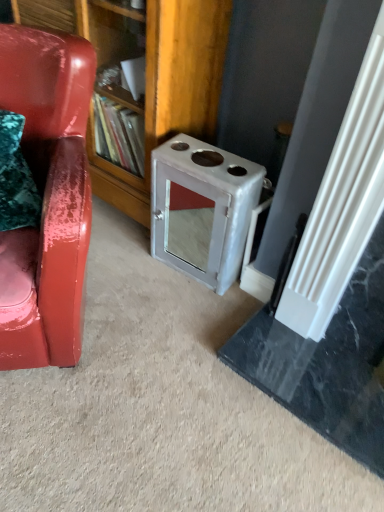
Where is `free space to the left of metallic gray stove at center-right`? The image size is (384, 512). free space to the left of metallic gray stove at center-right is located at coordinates [127, 262].